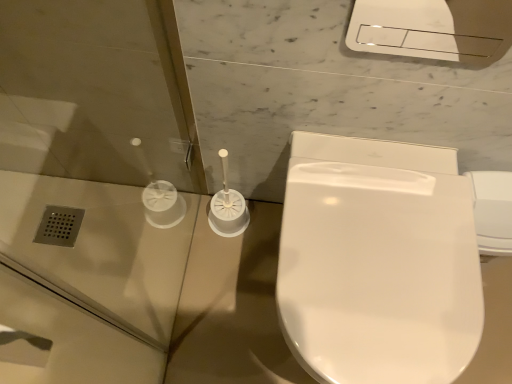
Question: Is white glossy toilet at center looking in the opposite direction of transparent plastic screen door at left?

Choices:
 (A) yes
 (B) no

Answer: (B)

Question: Are white glossy toilet at center and transparent plastic screen door at left located far from each other?

Choices:
 (A) no
 (B) yes

Answer: (A)

Question: Is white glossy toilet at center positioned beyond the bounds of transparent plastic screen door at left?

Choices:
 (A) no
 (B) yes

Answer: (B)

Question: Is white glossy toilet at center to the right of transparent plastic screen door at left from the viewer's perspective?

Choices:
 (A) no
 (B) yes

Answer: (B)

Question: Can you confirm if white glossy toilet at center is wider than transparent plastic screen door at left?

Choices:
 (A) no
 (B) yes

Answer: (B)

Question: Is white glossy toilet at center to the left of transparent plastic screen door at left from the viewer's perspective?

Choices:
 (A) no
 (B) yes

Answer: (A)

Question: Can you confirm if transparent plastic screen door at left is shorter than white glossy toilet at center?

Choices:
 (A) no
 (B) yes

Answer: (A)

Question: Can you confirm if transparent plastic screen door at left is wider than white glossy toilet at center?

Choices:
 (A) no
 (B) yes

Answer: (A)

Question: Is transparent plastic screen door at left thinner than white glossy toilet at center?

Choices:
 (A) no
 (B) yes

Answer: (B)

Question: Is the position of transparent plastic screen door at left more distant than that of white glossy toilet at center?

Choices:
 (A) yes
 (B) no

Answer: (B)

Question: Does transparent plastic screen door at left have a smaller size compared to white glossy toilet at center?

Choices:
 (A) yes
 (B) no

Answer: (A)

Question: Can you confirm if transparent plastic screen door at left is taller than white glossy toilet at center?

Choices:
 (A) yes
 (B) no

Answer: (A)

Question: From their relative heights in the image, would you say white glossy toilet at center is taller or shorter than transparent plastic screen door at left?

Choices:
 (A) short
 (B) tall

Answer: (A)